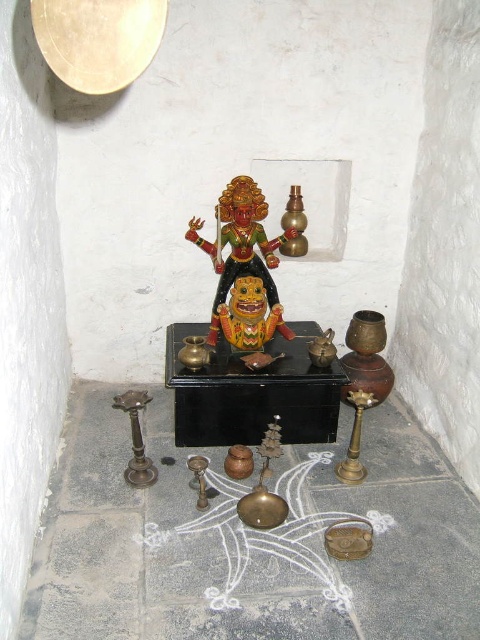
You are a temple caretaker who needs to place a new offering on the altar. The offering is exactly the same size as the glossy painted deity at center. Will the black polished altar at center be wide enough to accommodate the offering without it hanging over the edges?

The black polished altar at center is wider than the glossy painted deity at center, so the offering will fit without hanging over the edges.

You are a temple caretaker who needs to place a new offering on the altar. The offering is slightly larger than the glossy painted deity at center. Will the black polished altar at center have enough space to accommodate the offering?

The black polished altar at center is larger in size than the glossy painted deity at center. Since the offering is slightly larger than the deity, it should fit on the altar as the altar itself is bigger.

You are standing in front of the altar and want to place a small offering. There are two points marked on the altar where you can place it. The first point is at coordinate point(229, 353) and the second is at point(216, 208). Which point is closer to you?

Point(229, 353) is closer to the viewer than point(216, 208).